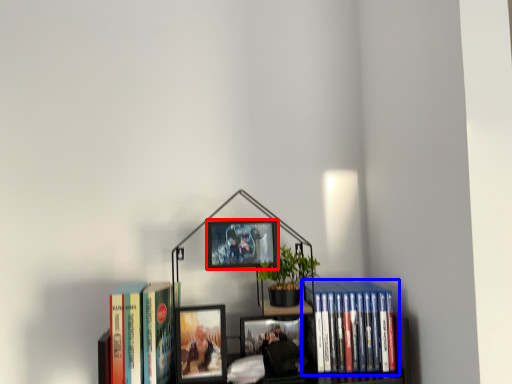
Question: Which object appears farthest to the camera in this image, picture frame (highlighted by a red box) or book (highlighted by a blue box)?

Choices:
 (A) picture frame
 (B) book

Answer: (B)